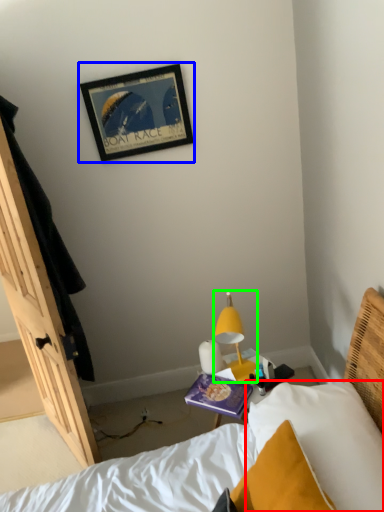
Question: Based on their relative distances, which object is nearer to pillow (highlighted by a red box)? Choose from picture frame (highlighted by a blue box) and lamp (highlighted by a green box).

Choices:
 (A) picture frame
 (B) lamp

Answer: (B)